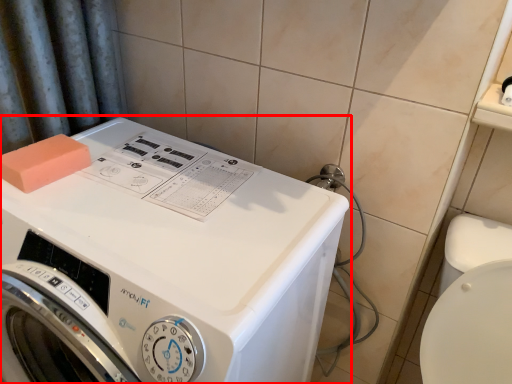
Question: Considering the relative positions of washing machine (annotated by the red box) and soap in the image provided, where is washing machine (annotated by the red box) located with respect to the staircase?

Choices:
 (A) left
 (B) right

Answer: (B)